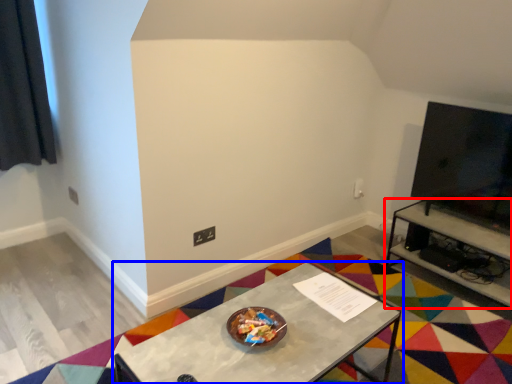
Question: Which of the following is the farthest to the observer, table (highlighted by a red box) or table (highlighted by a blue box)?

Choices:
 (A) table
 (B) table

Answer: (A)